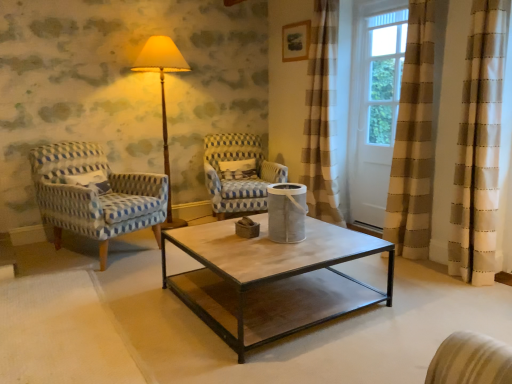
Question: Does white textured pillow at center have a greater height compared to white wood screen door at upper right?

Choices:
 (A) no
 (B) yes

Answer: (A)

Question: From a real-world perspective, is white textured pillow at center below white wood screen door at upper right?

Choices:
 (A) no
 (B) yes

Answer: (B)

Question: Does white textured pillow at center appear on the right side of white wood screen door at upper right?

Choices:
 (A) no
 (B) yes

Answer: (A)

Question: Is white textured pillow at center not close to white wood screen door at upper right?

Choices:
 (A) no
 (B) yes

Answer: (B)

Question: Can you confirm if white textured pillow at center is smaller than white wood screen door at upper right?

Choices:
 (A) yes
 (B) no

Answer: (A)

Question: From the image's perspective, relative to blue-patterned fabric armchair at left, which is the 1th chair from left to right, is white textured pillow at center above or below?

Choices:
 (A) above
 (B) below

Answer: (A)

Question: Is white textured pillow at center inside or outside of blue-patterned fabric armchair at left, which is the 1th chair from left to right?

Choices:
 (A) outside
 (B) inside

Answer: (A)

Question: In terms of height, does white textured pillow at center look taller or shorter compared to blue-patterned fabric armchair at left, which is the 1th chair from left to right?

Choices:
 (A) short
 (B) tall

Answer: (A)

Question: In the image, is white textured pillow at center positioned in front of or behind blue-patterned fabric armchair at left, which is the 2th chair from right to left?

Choices:
 (A) front
 (B) behind

Answer: (B)

Question: Is blue and white woven fabric armchair at center, which is the second chair in left-to-right order, bigger or smaller than white textured pillow at center?

Choices:
 (A) small
 (B) big

Answer: (B)

Question: Is blue and white woven fabric armchair at center, which is the second chair in left-to-right order, to the left or to the right of white textured pillow at center in the image?

Choices:
 (A) left
 (B) right

Answer: (B)

Question: Considering the positions of blue and white woven fabric armchair at center, which is the second chair in left-to-right order, and white textured pillow at center in the image, is blue and white woven fabric armchair at center, which is the second chair in left-to-right order, taller or shorter than white textured pillow at center?

Choices:
 (A) short
 (B) tall

Answer: (B)

Question: From the image's perspective, is blue and white woven fabric armchair at center, which appears as the 1th chair when viewed from the right, above or below white textured pillow at center?

Choices:
 (A) above
 (B) below

Answer: (B)

Question: Relative to matte yellow fabric at center, is blue and white woven fabric armchair at center, which appears as the 1th chair when viewed from the right, in front or behind?

Choices:
 (A) behind
 (B) front

Answer: (A)

Question: Based on their sizes in the image, would you say blue and white woven fabric armchair at center, which is the second chair in left-to-right order, is bigger or smaller than matte yellow fabric at center?

Choices:
 (A) big
 (B) small

Answer: (A)